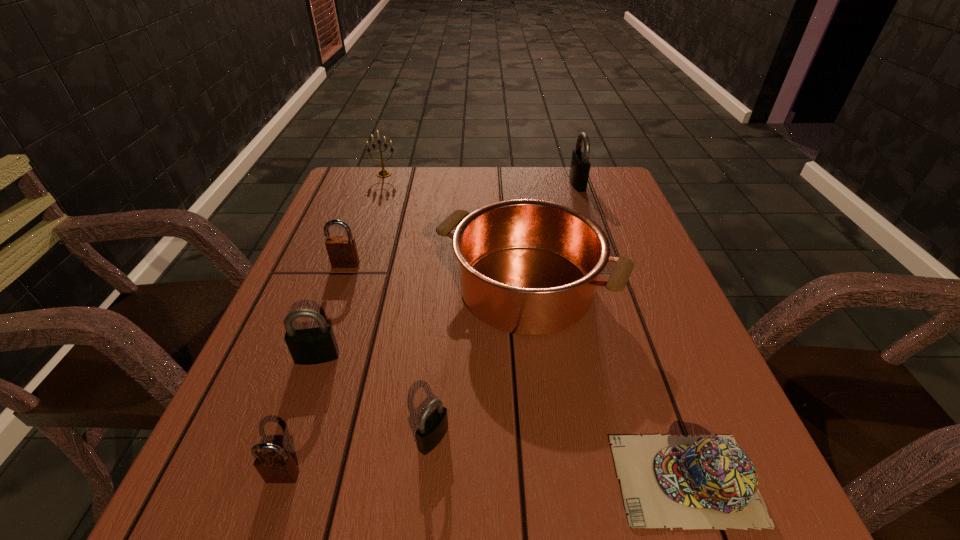
You are a GUI agent. You are given a task and a screenshot of the screen. Output one action in this format:
    pyautogui.click(x=<x>, y=<y>)
    Task: Click on the free space located 0.320m on the front, side, and top of the shortest object
    
    Given the screenshot: What is the action you would take?
    pyautogui.click(x=394, y=480)

The width and height of the screenshot is (960, 540). Find the location of `vacant area situated 0.180m on the front, side, and top of the shortest object`. vacant area situated 0.180m on the front, side, and top of the shortest object is located at coordinates (492, 480).

At what (x,y) coordinates should I click in order to perform the action: click on free space located 0.060m on the front, side, and top of the shortest object. Please return your answer as a coordinate pair (x, y). Image resolution: width=960 pixels, height=540 pixels. Looking at the image, I should click on (575, 480).

Image resolution: width=960 pixels, height=540 pixels. In order to click on padlock located at the far edge in this screenshot , I will do `click(580, 165)`.

Find the location of a particular element. The height and width of the screenshot is (540, 960). candelabrum that is at the far edge is located at coordinates (383, 173).

Identify the location of padlock that is at the near edge. This screenshot has width=960, height=540. (274, 467).

You are a GUI agent. You are given a task and a screenshot of the screen. Output one action in this format:
    pyautogui.click(x=<x>, y=<y>)
    Task: Click on the cap present at the near edge
    The height and width of the screenshot is (540, 960).
    Given the screenshot: What is the action you would take?
    pyautogui.click(x=700, y=482)

Find the location of a particular element. candelabrum that is at the left edge is located at coordinates (383, 173).

Find the location of a particular element. padlock that is at the right edge is located at coordinates (580, 165).

Identify the location of saucepan at the right edge. (529, 267).